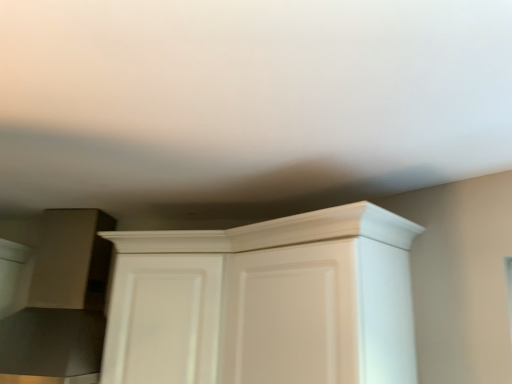
Question: Is white matte cupboard at center looking in the opposite direction of white glossy cabinet at center?

Choices:
 (A) yes
 (B) no

Answer: (A)

Question: Does white matte cupboard at center appear on the right side of white glossy cabinet at center?

Choices:
 (A) no
 (B) yes

Answer: (B)

Question: From a real-world perspective, is white matte cupboard at center positioned under white glossy cabinet at center based on gravity?

Choices:
 (A) no
 (B) yes

Answer: (B)

Question: Considering the relative sizes of white matte cupboard at center and white glossy cabinet at center in the image provided, is white matte cupboard at center shorter than white glossy cabinet at center?

Choices:
 (A) no
 (B) yes

Answer: (A)

Question: Considering the relative sizes of white matte cupboard at center and white glossy cabinet at center in the image provided, is white matte cupboard at center wider than white glossy cabinet at center?

Choices:
 (A) no
 (B) yes

Answer: (B)

Question: From a real-world perspective, is white matte cupboard at center on top of white glossy cabinet at center?

Choices:
 (A) no
 (B) yes

Answer: (A)

Question: Is white glossy cabinet at center not inside white matte cupboard at center?

Choices:
 (A) yes
 (B) no

Answer: (B)

Question: Is white glossy cabinet at center shorter than white matte cupboard at center?

Choices:
 (A) no
 (B) yes

Answer: (B)

Question: Is white glossy cabinet at center facing towards white matte cupboard at center?

Choices:
 (A) no
 (B) yes

Answer: (B)

Question: Is white glossy cabinet at center further to the viewer compared to white matte cupboard at center?

Choices:
 (A) no
 (B) yes

Answer: (B)

Question: From the image's perspective, would you say white glossy cabinet at center is positioned over white matte cupboard at center?

Choices:
 (A) no
 (B) yes

Answer: (A)

Question: From a real-world perspective, is white glossy cabinet at center positioned under white matte cupboard at center based on gravity?

Choices:
 (A) yes
 (B) no

Answer: (B)

Question: Visually, is white glossy cabinet at center positioned to the left or to the right of white matte cupboard at center?

Choices:
 (A) left
 (B) right

Answer: (A)